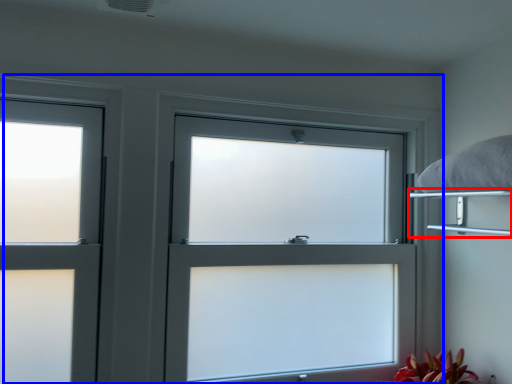
Question: Among these objects, which one is farthest to the camera, shelf (highlighted by a red box) or window (highlighted by a blue box)?

Choices:
 (A) shelf
 (B) window

Answer: (B)